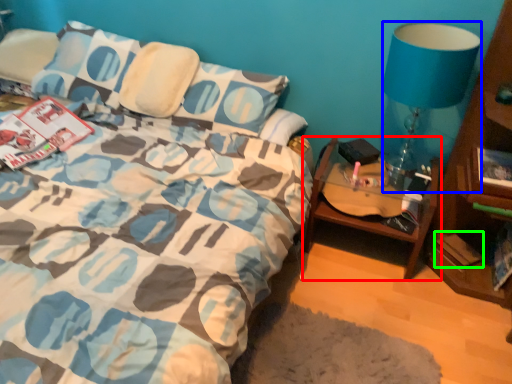
Question: Which object is the farthest from table (highlighted by a red box)? Choose among these: lamp (highlighted by a blue box) or paperback book (highlighted by a green box).

Choices:
 (A) lamp
 (B) paperback book

Answer: (A)